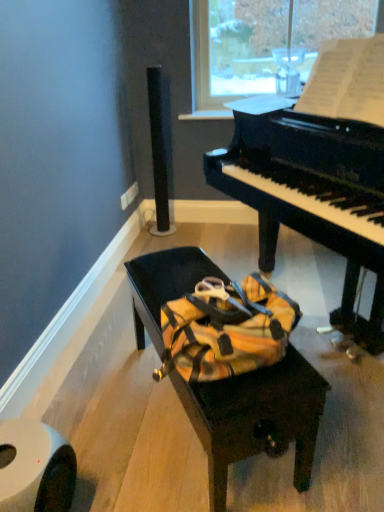
Identify the location of vacant space to the right of matte black bench at center. (338, 401).